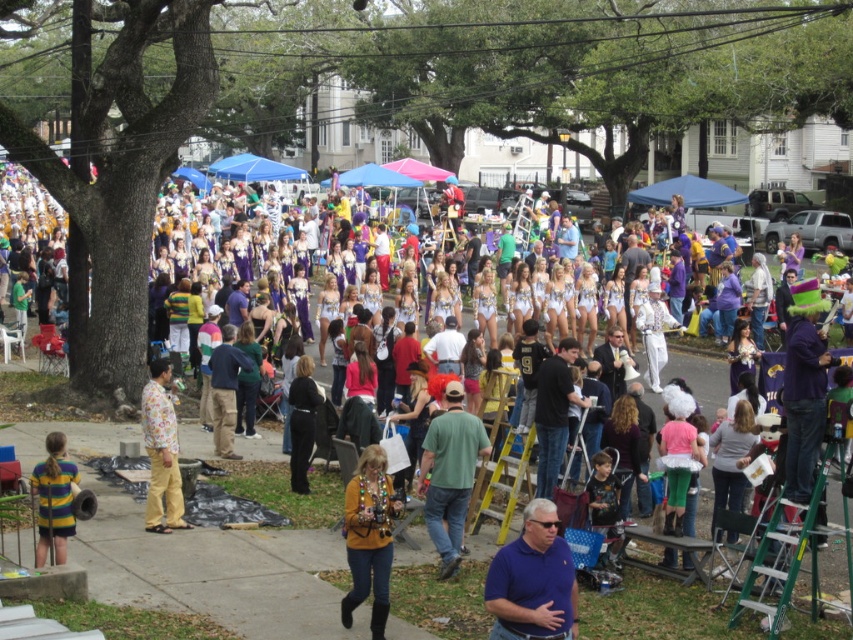
You are standing at the center of the image and want to locate the blue shirt at lower center. According to the 2D coordinates provided, in which direction should you look to find it?

The blue shirt at lower center is located at coordinates 0.908 on the x axis and 0.626 on the y axis. Since you are at the center, you should look to the right and slightly downward to find it.